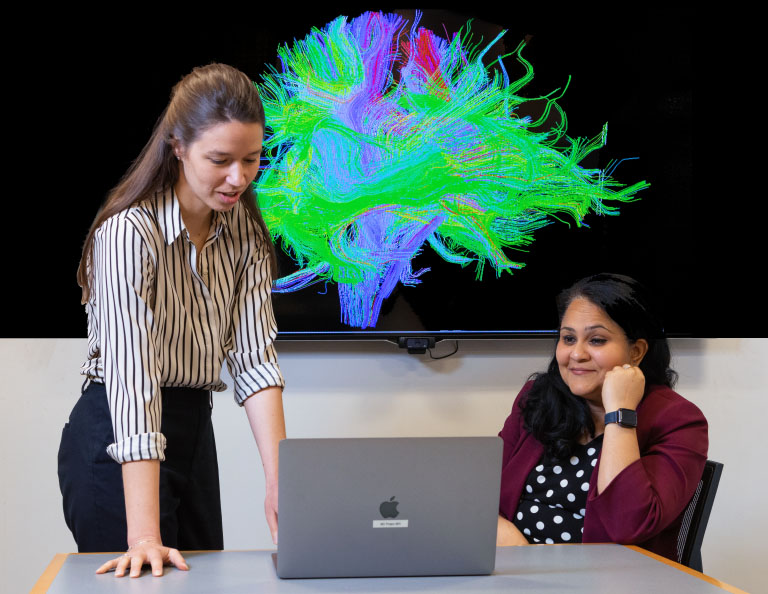
Locate an element on the screen. grey apple laptop is located at coordinates (439, 494).